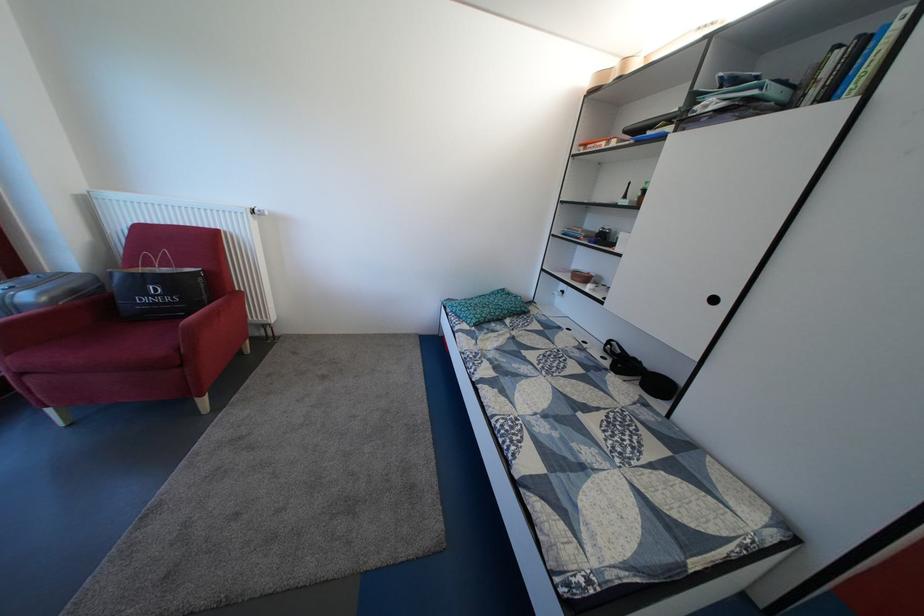
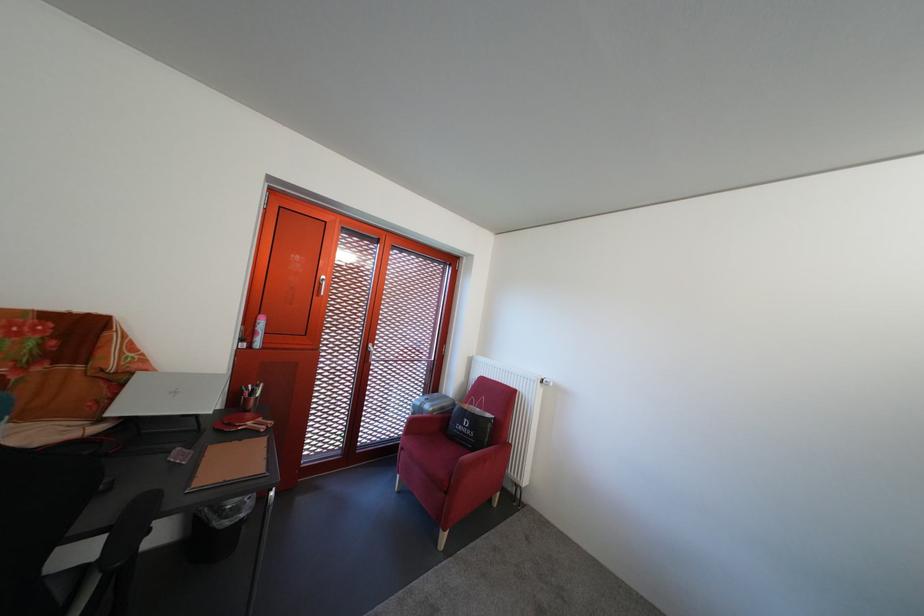
In the second image, find the point that corresponds to [215,302] in the first image.

(497, 446)